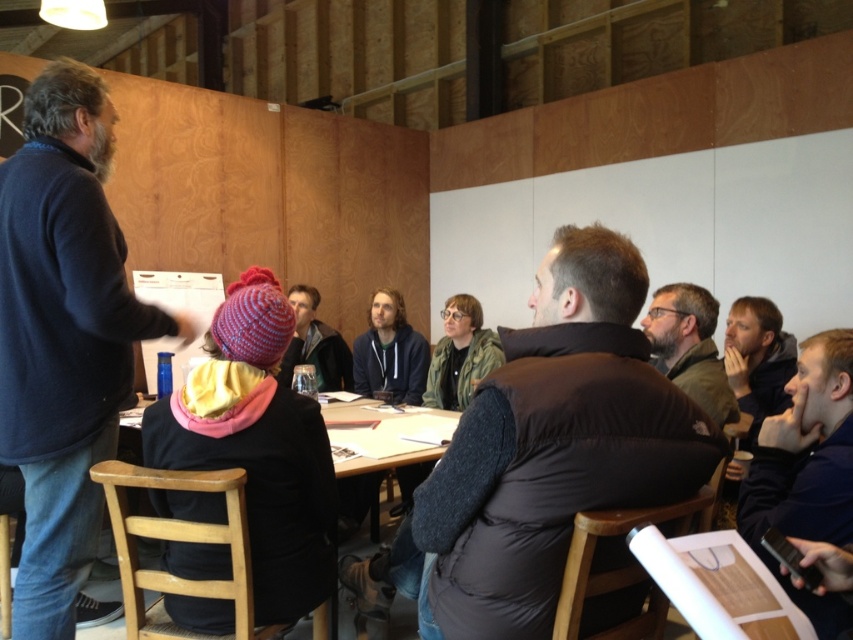
Between point (711, 333) and point (312, 307), which one is positioned behind?

Point (312, 307)

Does matte black jacket at center have a smaller size compared to knitted wool hat at center?

Correct, matte black jacket at center occupies less space than knitted wool hat at center.

Describe the element at coordinates (689, 348) in the screenshot. I see `matte black jacket at center` at that location.

Locate an element on the screen. matte black jacket at center is located at coordinates (689, 348).

Between dark blue sweater at left and dark blue hoodie at center, which one is positioned higher?

dark blue hoodie at center

Which is behind, point (157, 316) or point (376, 352)?

The point (376, 352) is more distant.

Measure the distance between point (80, 182) and camera.

The distance of point (80, 182) from camera is 5.61 feet.

The image size is (853, 640). What are the coordinates of `dark blue sweater at left` in the screenshot? It's located at (62, 337).

Does dark blue sweater at left appear on the left side of dark gray hoodie at center?

Indeed, dark blue sweater at left is positioned on the left side of dark gray hoodie at center.

Is dark blue sweater at left closer to camera compared to dark gray hoodie at center?

Yes.

What do you see at coordinates (62, 337) in the screenshot? This screenshot has height=640, width=853. I see `dark blue sweater at left` at bounding box center [62, 337].

Find the location of `dark blue sweater at left`. dark blue sweater at left is located at coordinates (62, 337).